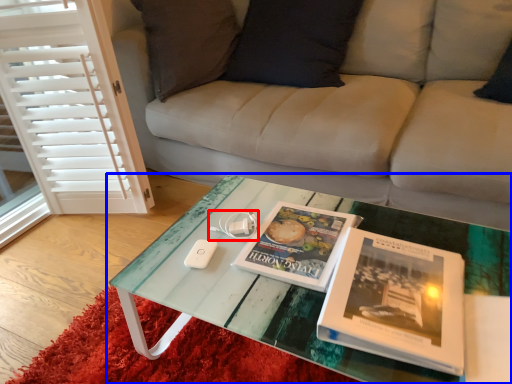
Question: Which object appears closest to the camera in this image, game controller (highlighted by a red box) or coffee table (highlighted by a blue box)?

Choices:
 (A) game controller
 (B) coffee table

Answer: (B)